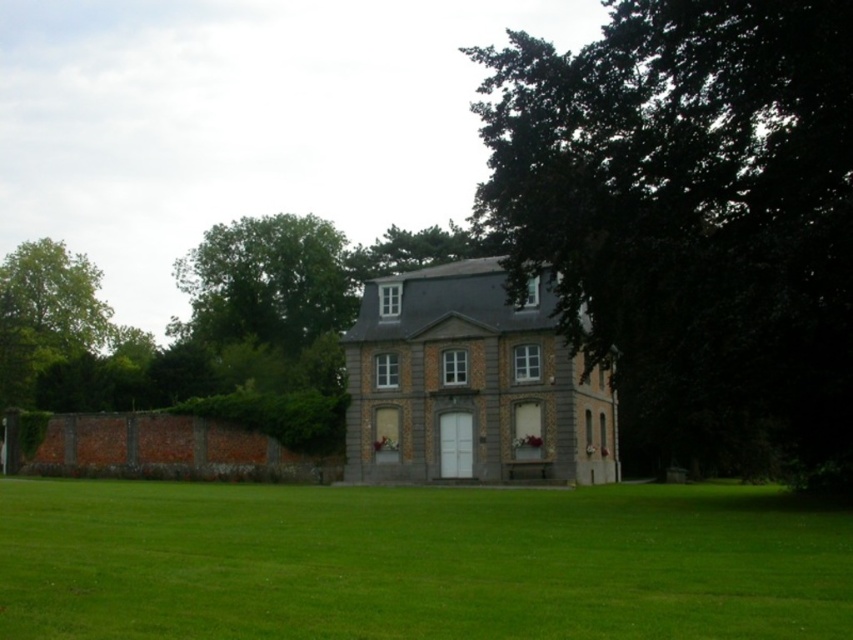
Is dark green leafy tree at upper right in front of green grass at center?

No.

The image size is (853, 640). Describe the element at coordinates (692, 218) in the screenshot. I see `dark green leafy tree at upper right` at that location.

You are a GUI agent. You are given a task and a screenshot of the screen. Output one action in this format:
    pyautogui.click(x=<x>, y=<y>)
    Task: Click on the dark green leafy tree at upper right
    This screenshot has width=853, height=640.
    Given the screenshot: What is the action you would take?
    pyautogui.click(x=692, y=218)